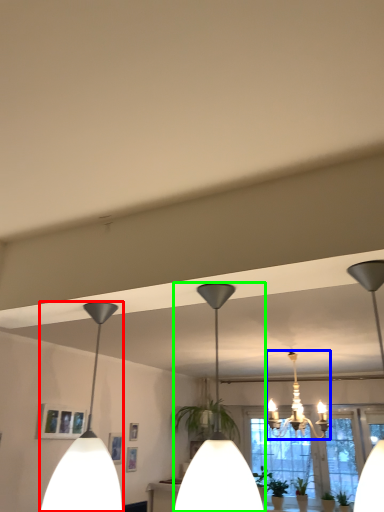
Question: Which is farther away from lamp (highlighted by a red box)? lamp (highlighted by a blue box) or lamp (highlighted by a green box)?

Choices:
 (A) lamp
 (B) lamp

Answer: (A)